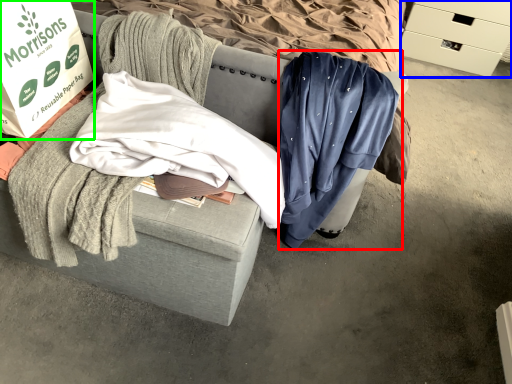
Question: Which object is positioned closest to clothing (highlighted by a red box)? Select from drawer (highlighted by a blue box) and box (highlighted by a green box).

Choices:
 (A) drawer
 (B) box

Answer: (B)